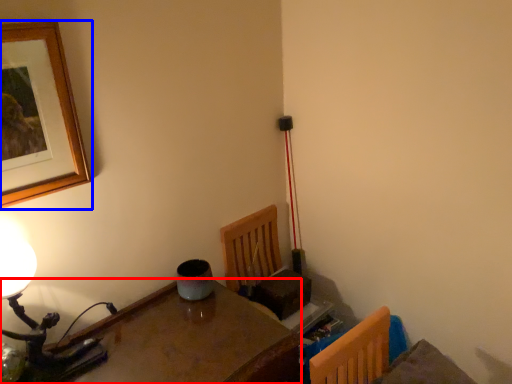
Question: Which point is closer to the camera, table (highlighted by a red box) or picture frame (highlighted by a blue box)?

Choices:
 (A) table
 (B) picture frame

Answer: (A)